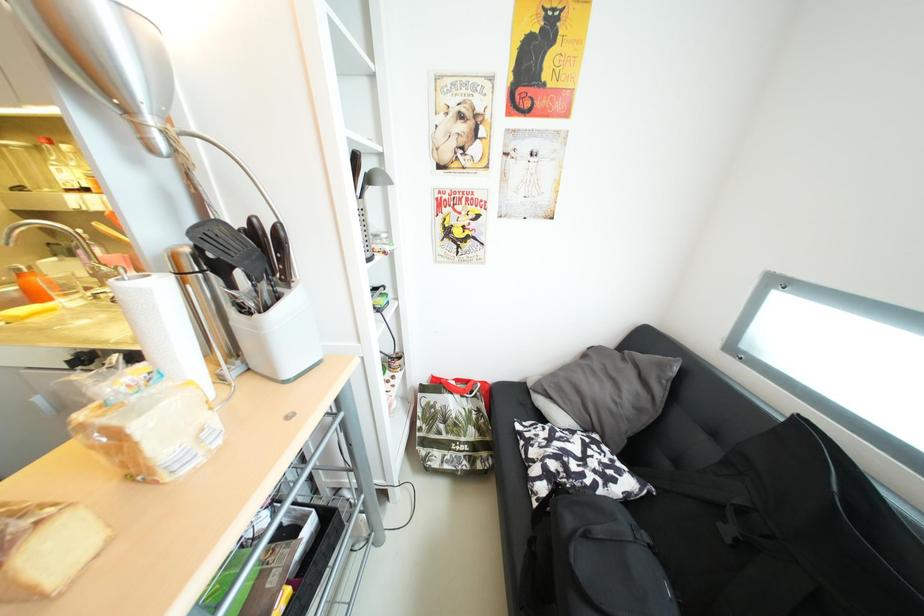
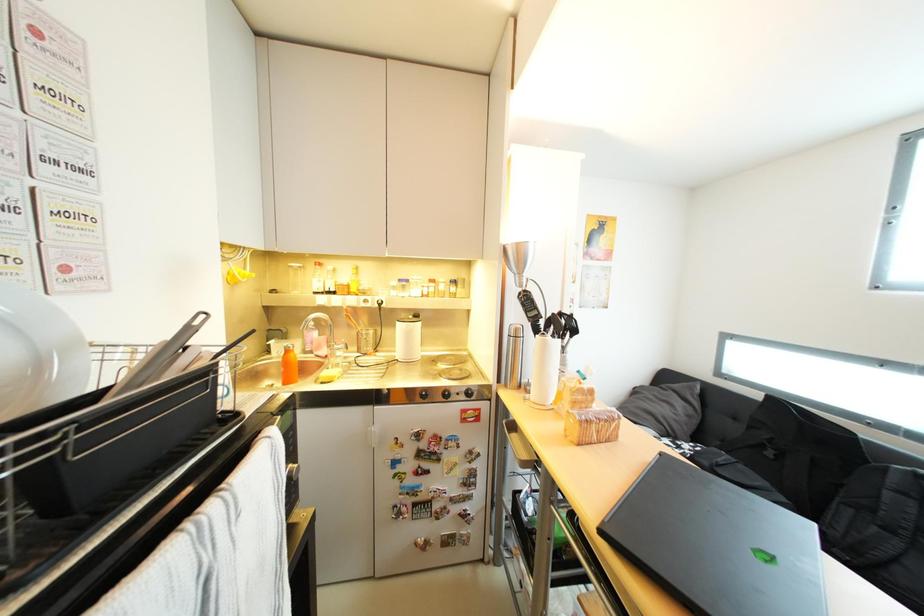
Which direction would the cameraman need to move to produce the second image?

The cameraman walked toward left, backward.